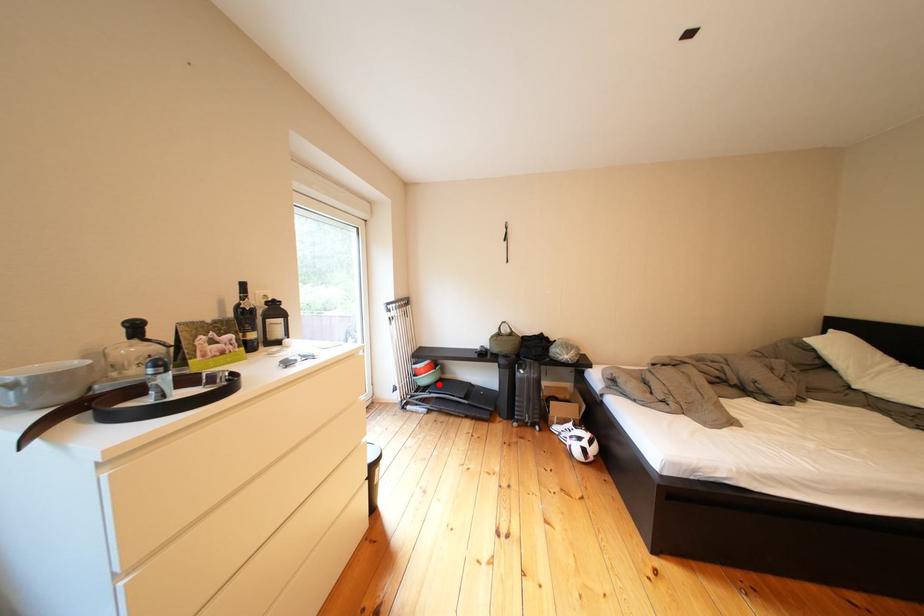
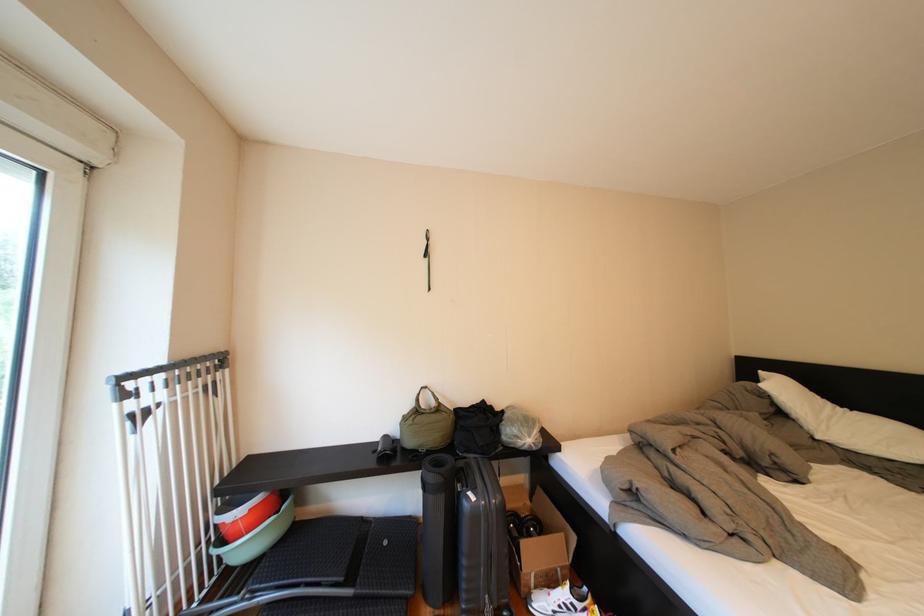
Question: I am providing you with two images of the same scene from different viewpoints. A red point is marked on the first image. Is the red point's position out of view in image 2?

Choices:
 (A) Yes
 (B) No

Answer: (B)